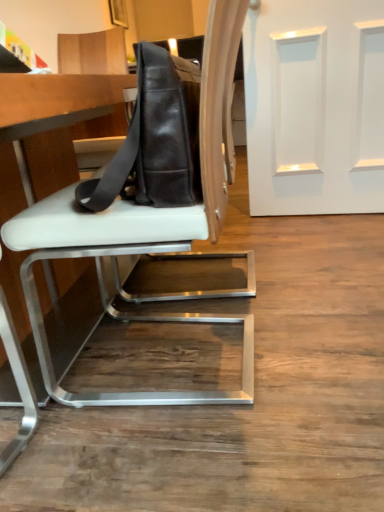
Locate an element on the screen. Image resolution: width=384 pixels, height=512 pixels. vacant space underneath white leather chair at center (from a real-world perspective) is located at coordinates (206, 354).